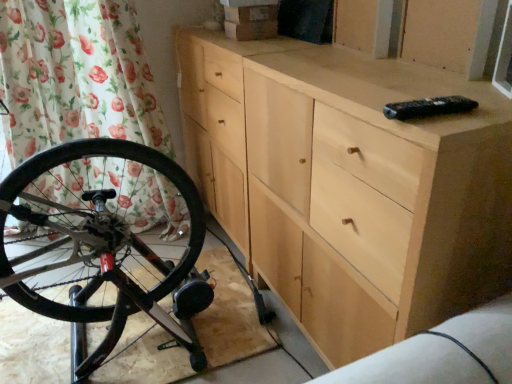
At what (x,y) coordinates should I click in order to perform the action: click on vacant area to the left of clear glass window screen at upper right. Please return your answer as a coordinate pair (x, y). Looking at the image, I should click on (436, 88).